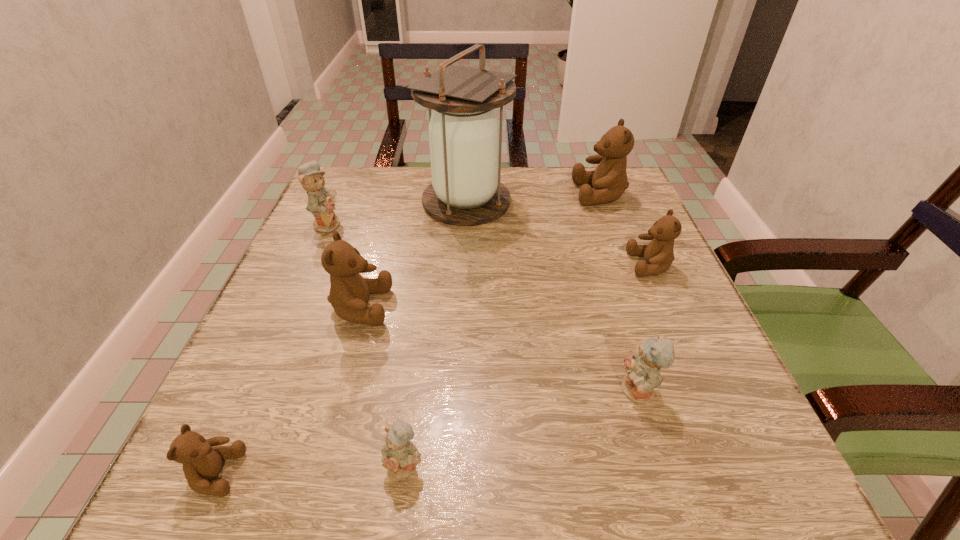
Where is `teddy bear that is the fourth closest to the second smallest brown teddy bear`? teddy bear that is the fourth closest to the second smallest brown teddy bear is located at coordinates (400, 457).

At what (x,y) coordinates should I click in order to perform the action: click on brown teddy bear that can be found as the third closest to the smallest blue teddy bear. Please return your answer as a coordinate pair (x, y). Looking at the image, I should click on (659, 254).

Locate which brown teddy bear is the fourth closest to the second farthest teddy bear. Please provide its 2D coordinates. Your answer should be formatted as a tuple, i.e. [(x, y)], where the tuple contains the x and y coordinates of a point satisfying the conditions above.

[(659, 254)]

Identify the location of the closest blue teddy bear to the third teddy bear from left to right. (321, 204).

Identify the location of blue teddy bear that can be found as the third closest to the fourth nearest teddy bear. (643, 371).

Where is `vacant position in the image that satisfies the following two spatial constraints: 1. on the front-facing side of the smallest blue teddy bear; 2. on the front-facing side of the nearest brown teddy bear`? The height and width of the screenshot is (540, 960). vacant position in the image that satisfies the following two spatial constraints: 1. on the front-facing side of the smallest blue teddy bear; 2. on the front-facing side of the nearest brown teddy bear is located at coordinates (403, 473).